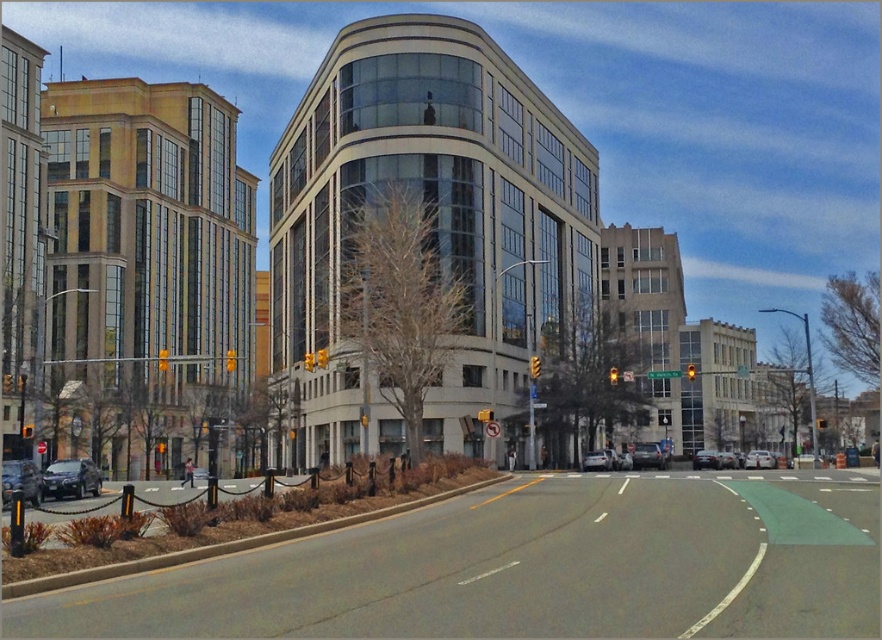
Can you confirm if shiny silver sedan at lower left is positioned to the right of white matte car at center?

Incorrect, shiny silver sedan at lower left is not on the right side of white matte car at center.

Is shiny silver sedan at lower left below white matte car at center?

No.

Between point (83, 467) and point (600, 461), which one is positioned behind?

Point (600, 461)

Where is `shiny silver sedan at lower left`? shiny silver sedan at lower left is located at coordinates (71, 477).

Does shiny silver sedan at lower left have a greater height compared to matte black sedan at center?

No.

Looking at this image, measure the distance between shiny silver sedan at lower left and camera.

A distance of 112.60 feet exists between shiny silver sedan at lower left and camera.

This screenshot has height=640, width=882. I want to click on shiny silver sedan at lower left, so click(x=71, y=477).

Between metallic silver sedan at center and matte black sedan at center, which one appears on the left side from the viewer's perspective?

metallic silver sedan at center is more to the left.

Is metallic silver sedan at center wider than matte black sedan at center?

In fact, metallic silver sedan at center might be narrower than matte black sedan at center.

Is point (654, 461) behind point (706, 452)?

No, (654, 461) is in front of (706, 452).

Where is `metallic silver sedan at center`? The image size is (882, 640). metallic silver sedan at center is located at coordinates (648, 456).